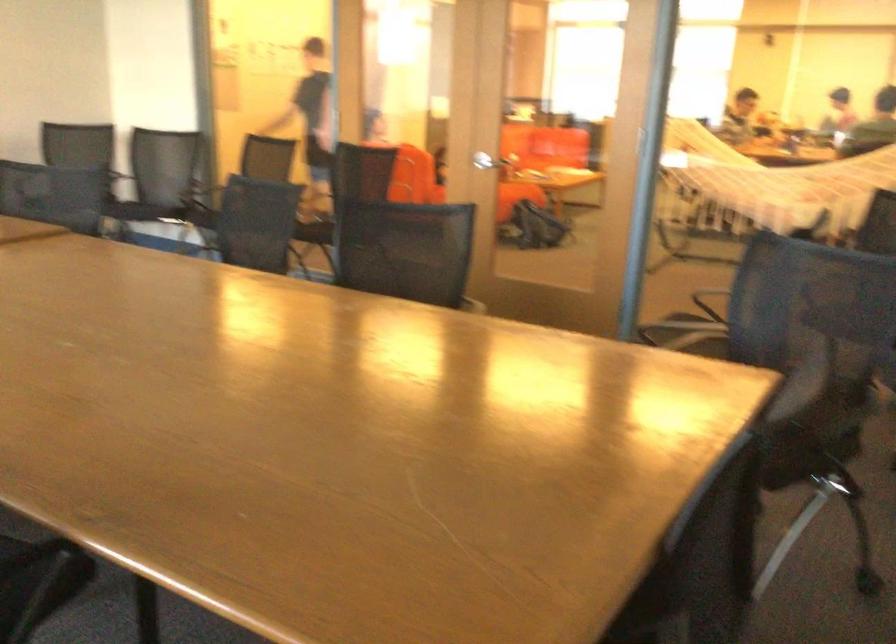
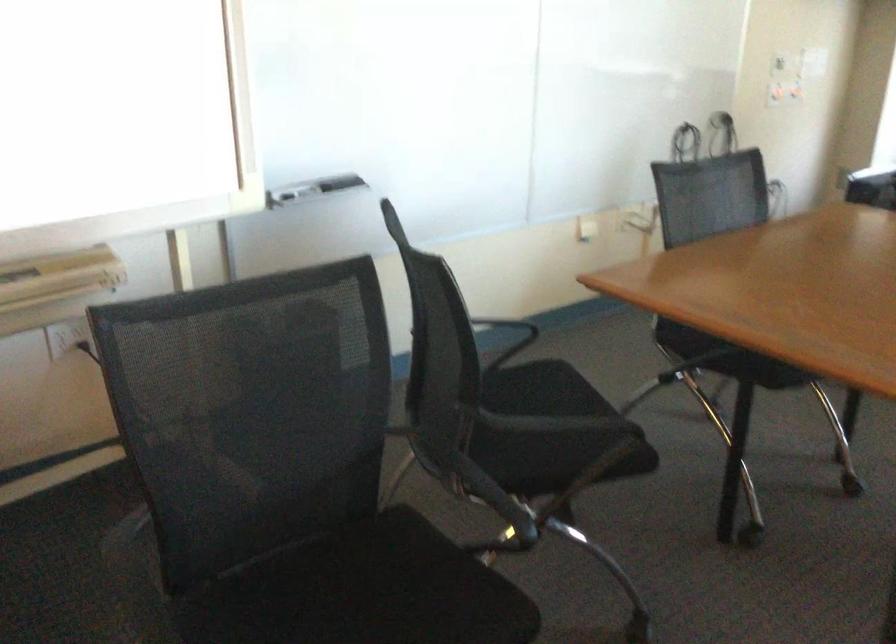
Locate, in the second image, the point that corresponds to point (702, 351) in the first image.

(363, 592)